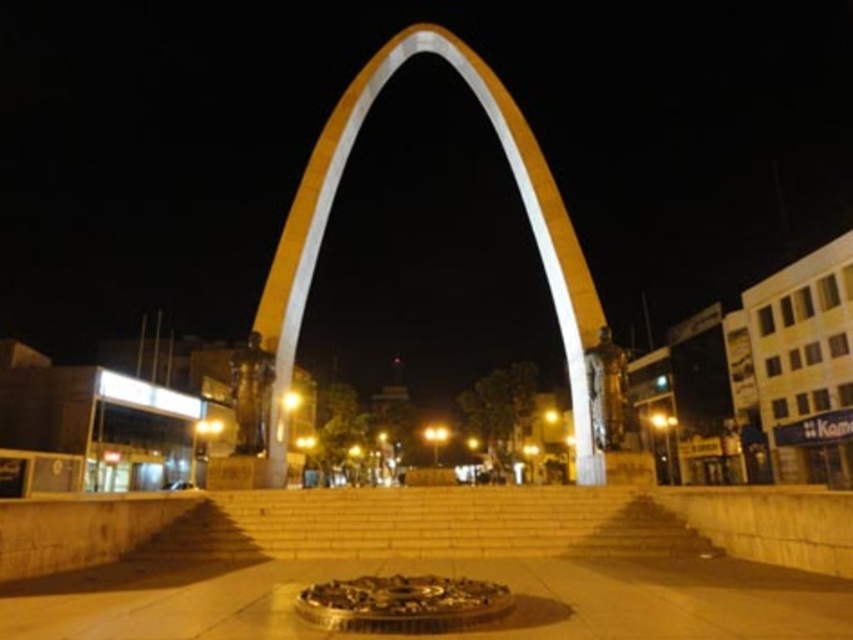
Can you confirm if light beige stone stairs at center is positioned to the right of yellow concrete arch at center?

Incorrect, light beige stone stairs at center is not on the right side of yellow concrete arch at center.

Which is in front, point (239, 518) or point (354, 77)?

Point (239, 518) is in front.

Identify the location of light beige stone stairs at center. This screenshot has width=853, height=640. (422, 524).